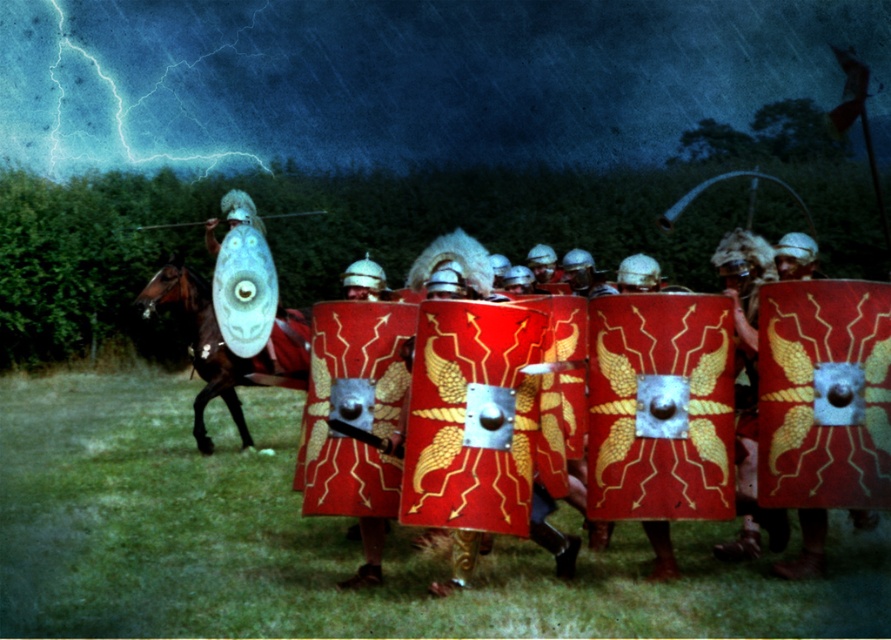
How much distance is there between shiny brown horse at left and translucent plastic shield at center?

A: shiny brown horse at left and translucent plastic shield at center are 19.06 inches apart from each other.

Identify the location of shiny brown horse at left. (226, 346).

Identify the location of shiny brown horse at left. (226, 346).